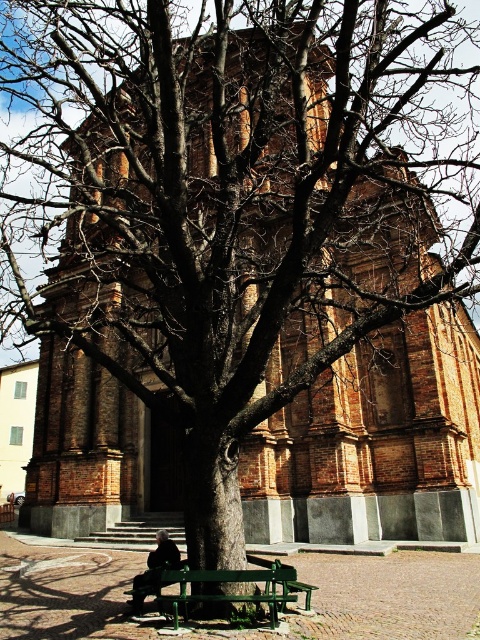
From the picture: You are a painter who wants to set up your easel between the green painted wood bench at lower center and the dark gray fabric coat at lower center to capture the historic brick building in your painting. Your easel requires a space of at least 10 feet between these two objects to position properly. Is there enough space for your easel?

The distance between the green painted wood bench at lower center and the dark gray fabric coat at lower center is 13.63 feet, which is more than the required 10 feet. Therefore, there is sufficient space for the easel between them.

Based on the photo, you are a visitor who wants to sit down and rest while keeping your coat close. The green painted wood bench at lower center and the dark gray fabric coat at lower center are both in view. Which object should you move to sit on the bench while keeping your coat nearby?

You should move the dark gray fabric coat at lower center to the left side of the bench since the green painted wood bench at lower center is currently on the right side of the coat. This way, you can sit on the bench and have your coat close by on the left side.

Based on the photo, you are a visitor who wants to sit down and rest while waiting for a friend. You see the green painted wood bench at lower center and the dark gray fabric coat at lower center. Which object can you sit on?

The green painted wood bench at lower center is larger in size compared to the dark gray fabric coat at lower center, so you can sit on the green painted wood bench at lower center.